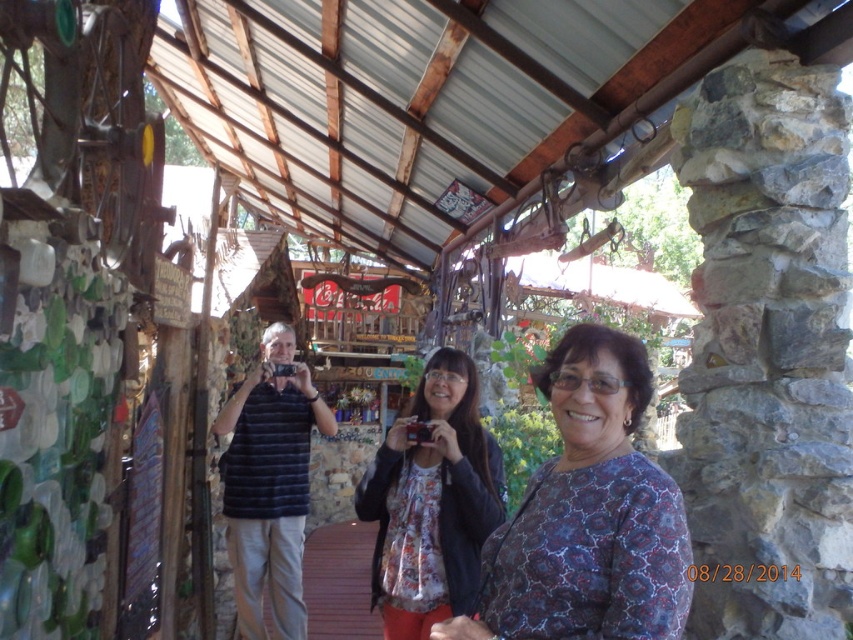
You are a photographer planning to take a group photo of the two people wearing the blue patterned blouse at center and dark blue striped shirt at center. Since you want to ensure both are clearly visible, which clothing item should you focus on first to make sure it stands out?

The blue patterned blouse at center is smaller than the dark blue striped shirt at center, so you should focus on the blue patterned blouse at center first to ensure it stands out in the photo.

You are a photographer setting up a photo shoot at this rustic structure. You notice two people wearing the blue patterned blouse at center and dark blue striped shirt at center. Which clothing item is shorter in height?

The blue patterned blouse at center is shorter in height compared to the dark blue striped shirt at center.

You are standing at the point marked by the coordinates (432, 502) in the image. Looking around, you see a floral fabric blouse at center. What object is located at your current position?

The point marked by the coordinates (432, 502) corresponds to the floral fabric blouse at center.